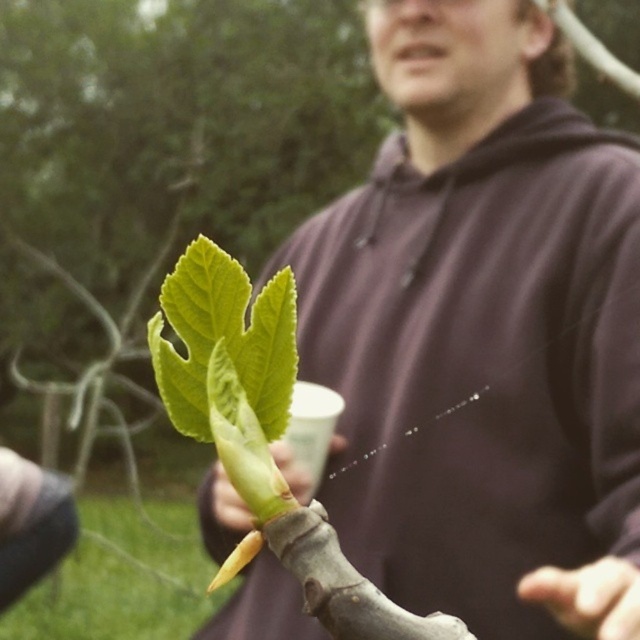
Does point (192, 406) lie in front of point (243, 520)?

Yes, it is in front of point (243, 520).

Between point (188, 276) and point (298, 465), which one is positioned behind?

The point (298, 465) is more distant.

Locate an element on the screen. This screenshot has width=640, height=640. green matte leaf at center is located at coordinates (224, 339).

Can you confirm if brown matte hoodie at center is positioned below green matte leaf at center?

No.

Image resolution: width=640 pixels, height=640 pixels. Find the location of `brown matte hoodie at center`. brown matte hoodie at center is located at coordinates (483, 332).

This screenshot has height=640, width=640. Find the location of `brown matte hoodie at center`. brown matte hoodie at center is located at coordinates (483, 332).

Between brown matte hoodie at center and green leafy branch at center, which one is positioned higher?

brown matte hoodie at center

Locate an element on the screen. brown matte hoodie at center is located at coordinates (483, 332).

I want to click on brown matte hoodie at center, so click(x=483, y=332).